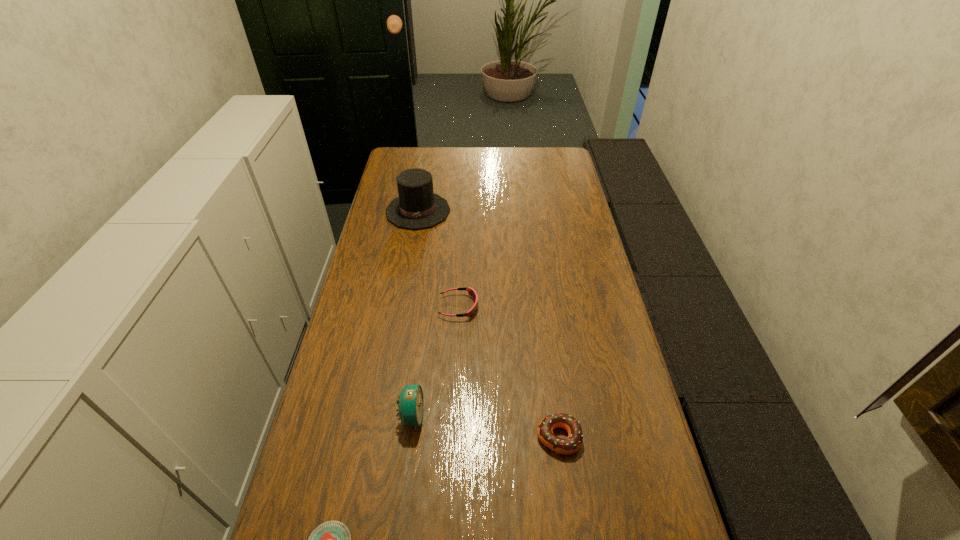
Where is `vacant space that is in between the alarm clock and the tallest object`? The height and width of the screenshot is (540, 960). vacant space that is in between the alarm clock and the tallest object is located at coordinates (415, 313).

Find the location of a particular element. Image resolution: width=960 pixels, height=540 pixels. object that is the closest to the dress hat is located at coordinates (471, 292).

Point out which object is positioned as the fourth nearest to the tallest object. Please provide its 2D coordinates. Your answer should be formatted as a tuple, i.e. [(x, y)], where the tuple contains the x and y coordinates of a point satisfying the conditions above.

[(332, 539)]

Locate an element on the screen. blank area in the image that satisfies the following two spatial constraints: 1. on the front-facing side of the goggles; 2. on the back side of the rightmost object is located at coordinates (452, 437).

Locate an element on the screen. The width and height of the screenshot is (960, 540). vacant region that satisfies the following two spatial constraints: 1. on the front-facing side of the second tallest object; 2. on the left side of the doughnut is located at coordinates (409, 437).

Identify the location of vacant space that satisfies the following two spatial constraints: 1. on the front-facing side of the goggles; 2. on the left side of the rightmost object. (452, 437).

The image size is (960, 540). Identify the location of vacant space that satisfies the following two spatial constraints: 1. on the front-facing side of the doughnut; 2. on the left side of the fourth shortest object. (409, 437).

Where is `vacant space that satisfies the following two spatial constraints: 1. on the front of the dress hat with the decoration; 2. on the right side of the doughnut`? vacant space that satisfies the following two spatial constraints: 1. on the front of the dress hat with the decoration; 2. on the right side of the doughnut is located at coordinates (379, 437).

Find the location of a particular element. free space in the image that satisfies the following two spatial constraints: 1. on the back side of the doughnut; 2. on the front-facing side of the second farthest object is located at coordinates (541, 307).

Locate an element on the screen. vacant region that satisfies the following two spatial constraints: 1. on the front of the dress hat with the decoration; 2. on the right side of the rightmost object is located at coordinates (379, 437).